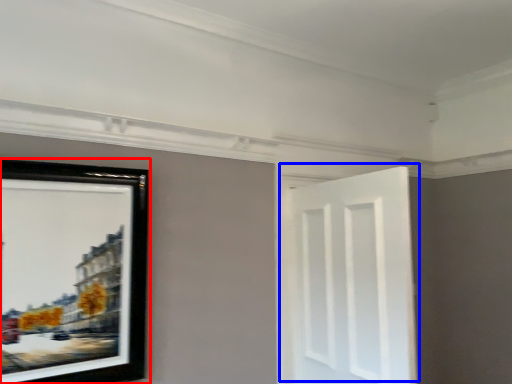
Question: Which of the following is the closest to the observer, picture frame (highlighted by a red box) or door (highlighted by a blue box)?

Choices:
 (A) picture frame
 (B) door

Answer: (A)